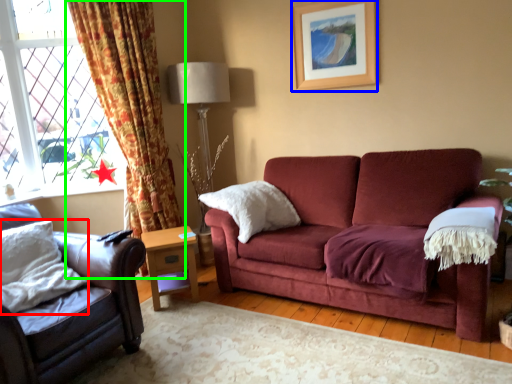
Question: Which is farther away from pillow (highlighted by a red box)? picture frame (highlighted by a blue box) or curtain (highlighted by a green box)?

Choices:
 (A) picture frame
 (B) curtain

Answer: (A)